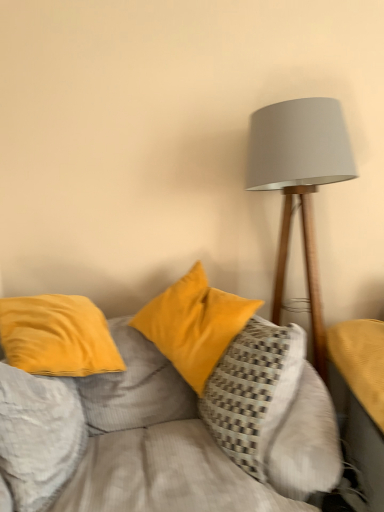
Question: From the image's perspective, is velvet yellow pillow at center, which is the first pillow in right-to-left order, located above or below velvet yellow pillows at center?

Choices:
 (A) above
 (B) below

Answer: (A)

Question: Considering the positions of point (269, 359) and point (251, 470), is point (269, 359) closer or farther from the camera than point (251, 470)?

Choices:
 (A) farther
 (B) closer

Answer: (A)

Question: Which of these objects is positioned closest to the velvet yellow pillows at center?

Choices:
 (A) velvet yellow pillow at center, which is the first pillow in right-to-left order
 (B) yellow fabric table at right
 (C) velvet yellow pillow at left, the third pillow from the right
 (D) matte gray lampshade at right
 (E) velvet yellow pillow at center, the 2th pillow in the right-to-left sequence

Answer: (A)

Question: Which object is the closest to the velvet yellow pillow at center, which ranks as the second pillow in left-to-right order?

Choices:
 (A) velvet yellow pillows at center
 (B) velvet yellow pillow at left, the third pillow from the right
 (C) yellow fabric table at right
 (D) velvet yellow pillow at center, which is the first pillow in right-to-left order
 (E) matte gray lampshade at right

Answer: (A)